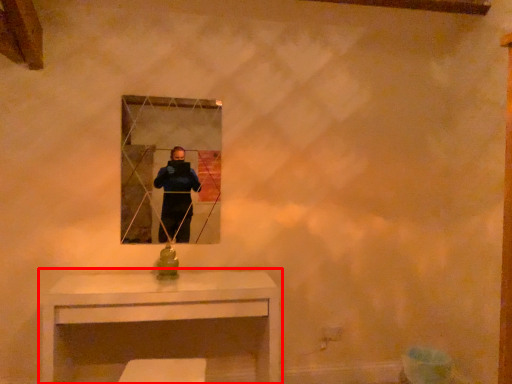
Question: From the image, what is the correct spatial relationship of table (annotated by the red box) in relation to mirror?

Choices:
 (A) right
 (B) left

Answer: (A)